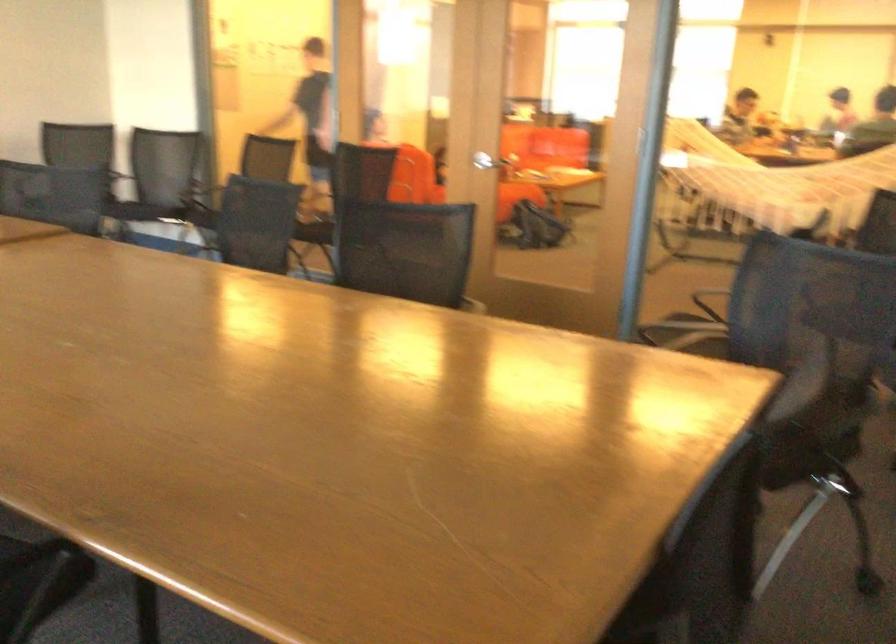
Where would you sit the sofa sitting surface? Please return your answer as a coordinate pair (x, y).

(538, 160)